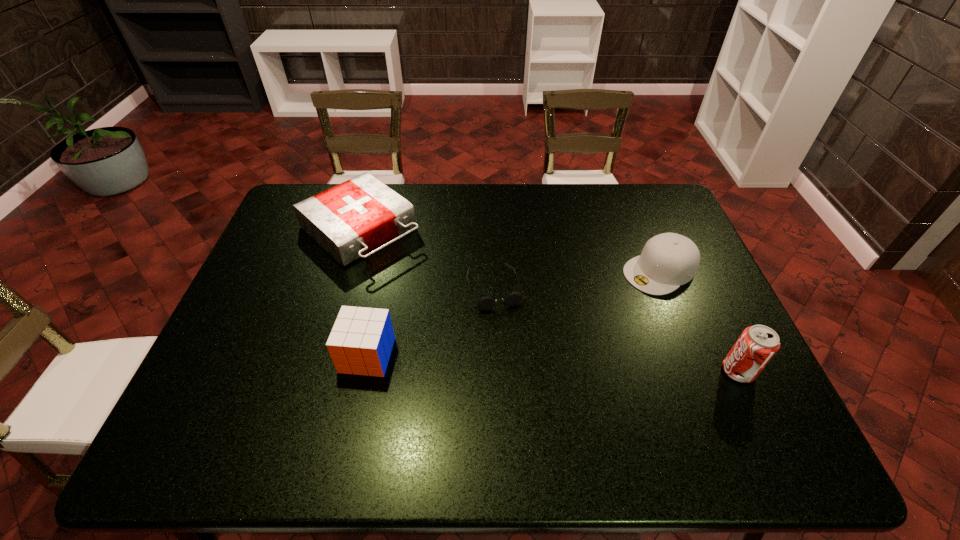
Locate an element on the screen. This screenshot has width=960, height=540. blank region between the cap and the tallest object is located at coordinates (699, 321).

Identify the location of empty space between the second tallest object and the sunglasses. The width and height of the screenshot is (960, 540). (431, 322).

The width and height of the screenshot is (960, 540). I want to click on free point between the tallest object and the cap, so click(699, 321).

You are a GUI agent. You are given a task and a screenshot of the screen. Output one action in this format:
    pyautogui.click(x=<x>, y=<y>)
    Task: Click on the free point between the soda can and the cap
    
    Given the screenshot: What is the action you would take?
    pyautogui.click(x=699, y=321)

Where is `vacant region between the third object from left to right and the cap`? The height and width of the screenshot is (540, 960). vacant region between the third object from left to right and the cap is located at coordinates (578, 279).

This screenshot has height=540, width=960. I want to click on free spot between the second tallest object and the first-aid kit, so click(364, 293).

Locate an element on the screen. The image size is (960, 540). free space that is in between the sunglasses and the tallest object is located at coordinates (616, 329).

Image resolution: width=960 pixels, height=540 pixels. In order to click on free space between the soda can and the first-aid kit in this screenshot , I will do `click(549, 300)`.

Find the location of a particular element. This screenshot has height=540, width=960. object that is the second closest one to the cube is located at coordinates (349, 220).

Locate an element on the screen. object that stands as the closest to the cap is located at coordinates (757, 344).